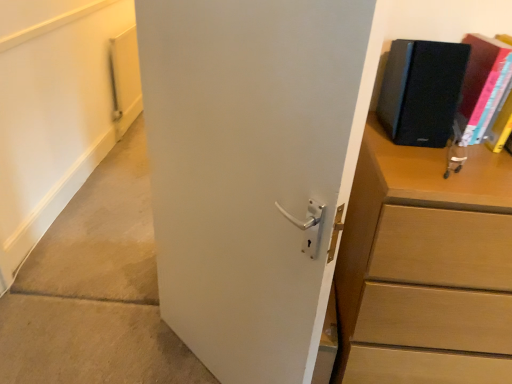
Question: Visually, is wooden chest of drawers at right positioned to the left or to the right of matte black book at upper right, arranged as the second paperback book when viewed from the left?

Choices:
 (A) right
 (B) left

Answer: (A)

Question: Looking at their shapes, would you say wooden chest of drawers at right is wider or thinner than matte black book at upper right, arranged as the second paperback book when viewed from the left?

Choices:
 (A) thin
 (B) wide

Answer: (B)

Question: Estimate the real-world distances between objects in this image. Which object is closer to the matte black book at upper right, arranged as the 1th paperback book when viewed from the right?

Choices:
 (A) black matte speaker at upper right, which is the first paperback book from left to right
 (B) white matte door at center
 (C) wooden chest of drawers at right

Answer: (A)

Question: Estimate the real-world distances between objects in this image. Which object is farther from the black matte speaker at upper right, which is the second paperback book from right to left?

Choices:
 (A) matte black book at upper right, arranged as the 1th paperback book when viewed from the right
 (B) white matte door at center
 (C) wooden chest of drawers at right

Answer: (B)